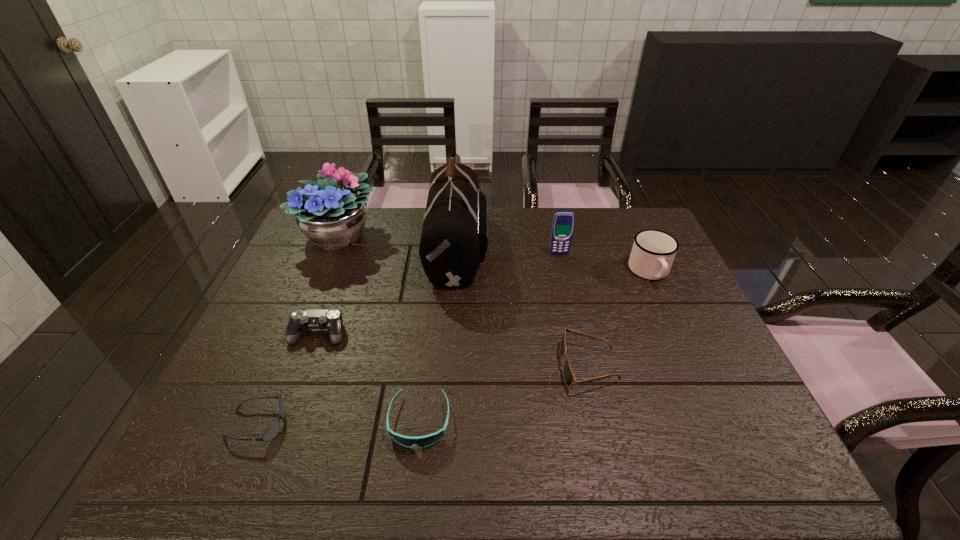
The width and height of the screenshot is (960, 540). In order to click on vacant space at the left edge in this screenshot , I will do pos(305,258).

You are a GUI agent. You are given a task and a screenshot of the screen. Output one action in this format:
    pyautogui.click(x=<x>, y=<y>)
    Task: Click on the vacant region at the right edge
    
    Given the screenshot: What is the action you would take?
    pyautogui.click(x=686, y=370)

What are the coordinates of `free region at the far right corner` in the screenshot? It's located at (615, 210).

The width and height of the screenshot is (960, 540). In order to click on free space at the near right corner in this screenshot , I will do `click(754, 445)`.

Locate an element on the screen. The height and width of the screenshot is (540, 960). vacant space that is in between the rightmost sunglasses and the fourth tallest object is located at coordinates (619, 319).

Where is `unoccupied position between the control and the bouquet`? The image size is (960, 540). unoccupied position between the control and the bouquet is located at coordinates (329, 285).

What are the coordinates of `free spot between the mug and the cellular telephone` in the screenshot? It's located at (605, 263).

This screenshot has height=540, width=960. I want to click on free space between the duffel bag and the shortest sunglasses, so click(x=357, y=336).

You are a GUI agent. You are given a task and a screenshot of the screen. Output one action in this format:
    pyautogui.click(x=<x>, y=<y>)
    Task: Click on the free space between the tallest object and the second sunglasses from left to right
    
    Given the screenshot: What is the action you would take?
    pyautogui.click(x=439, y=334)

The width and height of the screenshot is (960, 540). What are the coordinates of `free space that is in between the rightmost object and the rightmost sunglasses` in the screenshot? It's located at (619, 319).